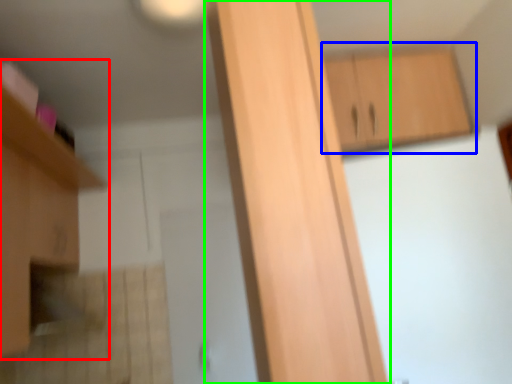
Question: Considering the real-world distances, which object is farthest from cabinetry (highlighted by a red box)? cabinetry (highlighted by a blue box) or cabinetry (highlighted by a green box)?

Choices:
 (A) cabinetry
 (B) cabinetry

Answer: (A)